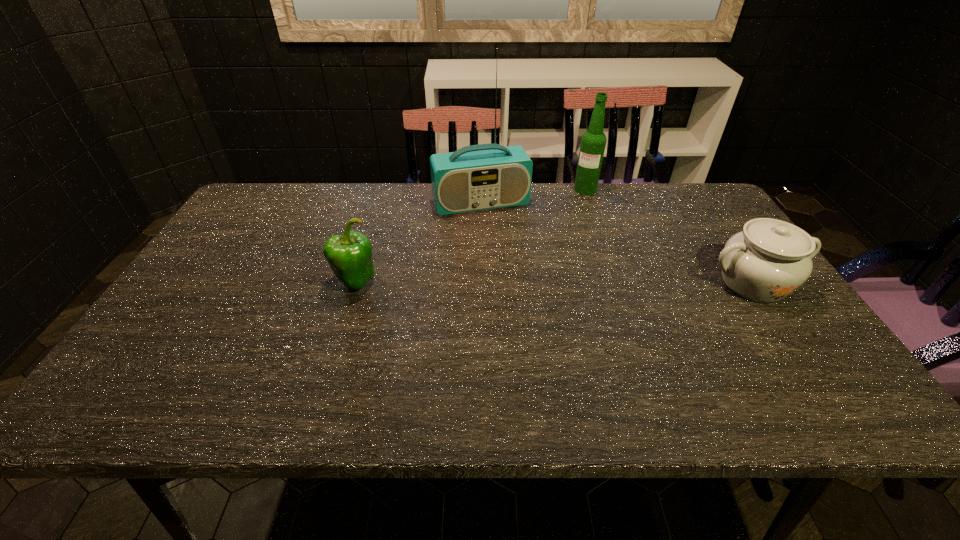
Find the location of a particular element. This screenshot has width=960, height=540. free point at the right edge is located at coordinates (724, 285).

The width and height of the screenshot is (960, 540). In the image, there is a desktop. Find the location of `vacant area at the far left corner`. vacant area at the far left corner is located at coordinates (273, 200).

Where is `blank space at the far right corner of the desktop`? The width and height of the screenshot is (960, 540). blank space at the far right corner of the desktop is located at coordinates (657, 184).

Where is `unoccupied position between the leftmost object and the rightmost object`? unoccupied position between the leftmost object and the rightmost object is located at coordinates (554, 283).

This screenshot has height=540, width=960. I want to click on free space that is in between the chinaware and the third object from left to right, so click(x=669, y=237).

You are a GUI agent. You are given a task and a screenshot of the screen. Output one action in this format:
    pyautogui.click(x=<x>, y=<y>)
    Task: Click on the free space between the tallest object and the rightmost object
    This screenshot has height=540, width=960.
    Given the screenshot: What is the action you would take?
    pyautogui.click(x=617, y=243)

Image resolution: width=960 pixels, height=540 pixels. I want to click on vacant area that lies between the leftmost object and the beer bottle, so click(x=470, y=236).

Locate an element on the screen. free space between the third object from left to right and the bell pepper is located at coordinates (470, 236).

Find the location of a particular element. The width and height of the screenshot is (960, 540). free space between the third object from right to left and the bell pepper is located at coordinates (418, 243).

This screenshot has height=540, width=960. I want to click on free space between the beer bottle and the bell pepper, so click(470, 236).